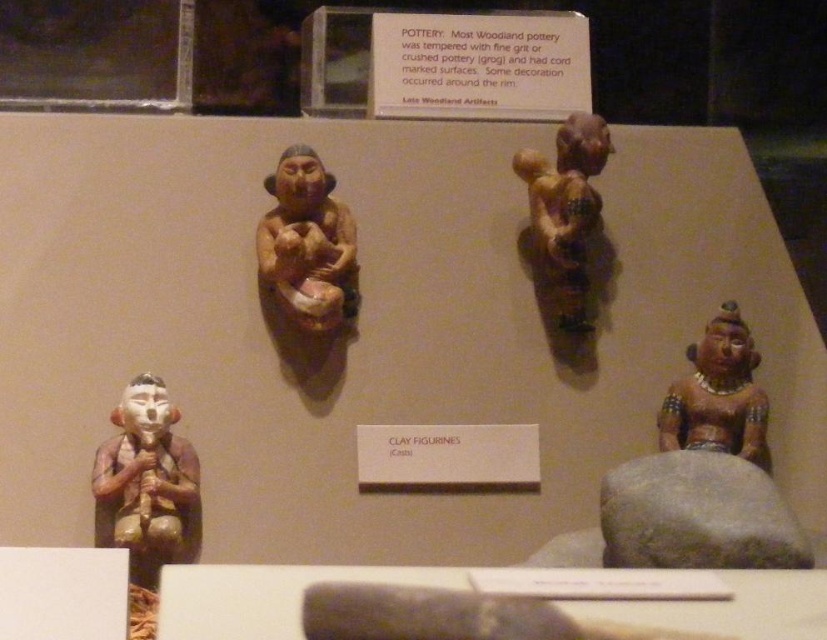
Looking at this image, is matte clay figurine at center taller than matte clay figurine at lower right?

Correct, matte clay figurine at center is much taller as matte clay figurine at lower right.

Who is more forward, (304, 250) or (715, 372)?

Positioned in front is point (304, 250).

Between point (306, 205) and point (687, 417), which one is positioned in front?

Point (687, 417) is more forward.

You are a GUI agent. You are given a task and a screenshot of the screen. Output one action in this format:
    pyautogui.click(x=<x>, y=<y>)
    Task: Click on the matte clay figurine at center
    
    Given the screenshot: What is the action you would take?
    click(x=308, y=243)

Measure the distance from brown matte figurine at center-right to matte clay figurine at lower right.

48.34 centimeters

Describe the element at coordinates (565, 212) in the screenshot. I see `brown matte figurine at center-right` at that location.

Identify the location of brown matte figurine at center-right. (565, 212).

Consider the image. Is matte brown figurine at lower left bigger than brown matte figurine at center-right?

Incorrect, matte brown figurine at lower left is not larger than brown matte figurine at center-right.

Between point (147, 506) and point (562, 310), which one is positioned behind?

The point (562, 310) is more distant.

Image resolution: width=827 pixels, height=640 pixels. In order to click on matte brown figurine at lower left in this screenshot , I will do `click(147, 476)`.

The height and width of the screenshot is (640, 827). What are the coordinates of `matte brown figurine at lower left` in the screenshot? It's located at click(x=147, y=476).